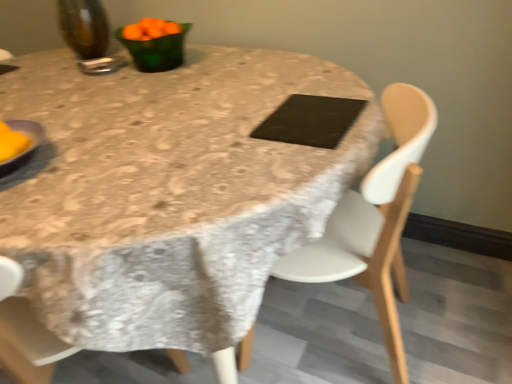
Find the location of a particular element. The width and height of the screenshot is (512, 384). unoccupied space behind black matte pad at center is located at coordinates [296, 91].